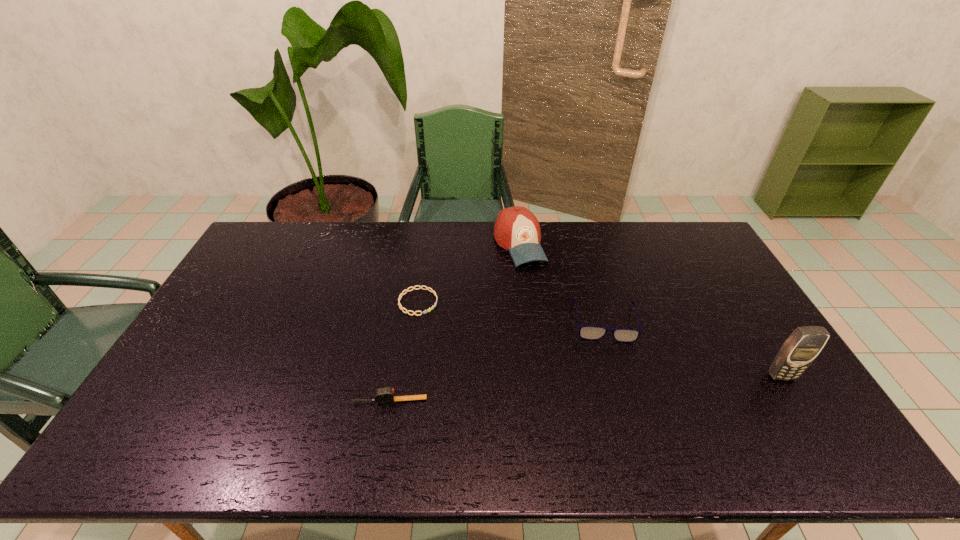
Find the location of a particular element. vacant spot on the desktop that is between the tape measure and the cellular telephone and is positioned on the front-facing side of the baseball cap is located at coordinates (597, 388).

In order to click on free space on the desktop that is between the tape measure and the tallest object and is positioned on the front-facing side of the third tallest object in this screenshot , I will do `click(616, 387)`.

The image size is (960, 540). Find the location of `free space on the desktop that is between the fourth tallest object and the cellular telephone and is positioned on the surface of the shortest object showing star-shaped elements`. free space on the desktop that is between the fourth tallest object and the cellular telephone and is positioned on the surface of the shortest object showing star-shaped elements is located at coordinates (600, 388).